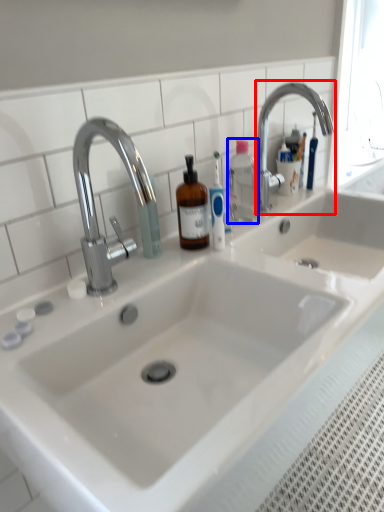
Question: Which object is closer to the camera taking this photo, tap (highlighted by a red box) or bottle (highlighted by a blue box)?

Choices:
 (A) tap
 (B) bottle

Answer: (A)